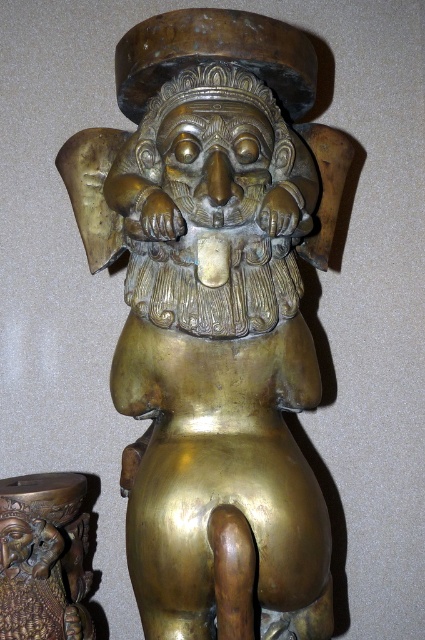
Who is positioned more to the right, shiny gold statue at center or brass statue at center?

shiny gold statue at center

Can you confirm if shiny gold statue at center is positioned above brass statue at center?

Yes, shiny gold statue at center is above brass statue at center.

Does point (170, 531) come farther from viewer compared to point (11, 484)?

No, it is not.

At what (x,y) coordinates should I click in order to perform the action: click on shiny gold statue at center. Please return your answer as a coordinate pair (x, y). The width and height of the screenshot is (425, 640). Looking at the image, I should click on (215, 317).